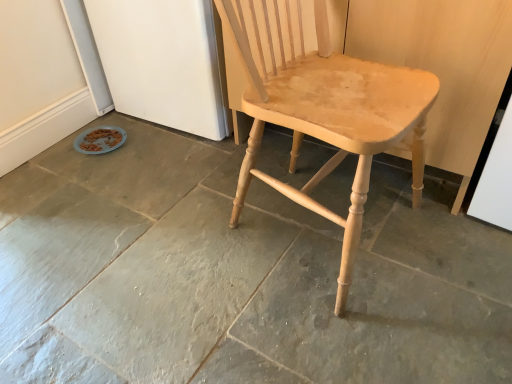
Question: In the image, is natural stone floor at center positioned in front of or behind natural wood chair at center?

Choices:
 (A) behind
 (B) front

Answer: (A)

Question: Is natural stone floor at center inside the boundaries of natural wood chair at center, or outside?

Choices:
 (A) inside
 (B) outside

Answer: (B)

Question: From the image's perspective, is natural stone floor at center positioned above or below natural wood chair at center?

Choices:
 (A) above
 (B) below

Answer: (B)

Question: Would you say natural wood chair at center is to the left or to the right of natural stone floor at center in the picture?

Choices:
 (A) right
 (B) left

Answer: (A)

Question: From the image's perspective, is natural wood chair at center located above or below natural stone floor at center?

Choices:
 (A) below
 (B) above

Answer: (B)

Question: In the image, is natural wood chair at center positioned in front of or behind natural stone floor at center?

Choices:
 (A) front
 (B) behind

Answer: (A)

Question: From a real-world perspective, is natural wood chair at center positioned above or below natural stone floor at center?

Choices:
 (A) above
 (B) below

Answer: (A)